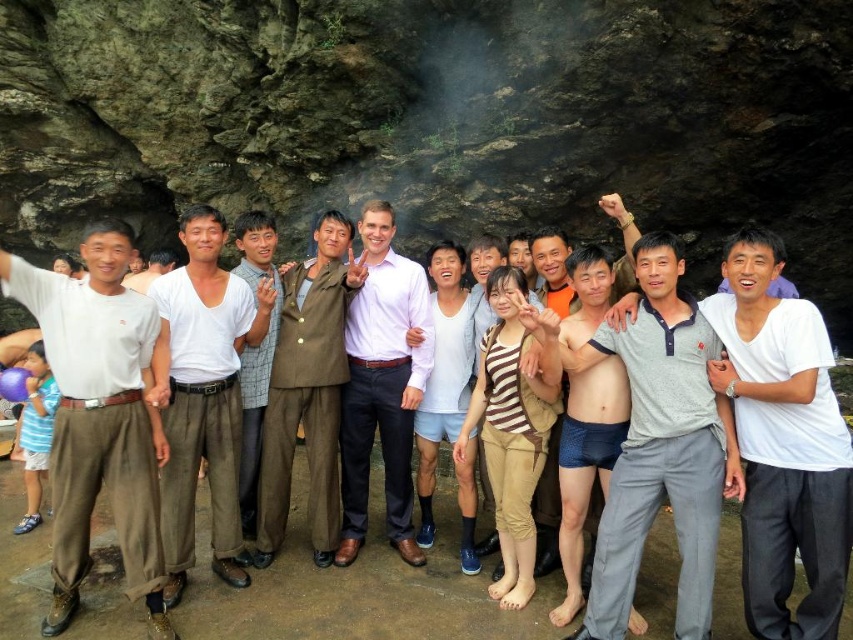
Question: Is white cotton shirt at center bigger than light brown cotton shirt at center?

Choices:
 (A) no
 (B) yes

Answer: (A)

Question: From the image, what is the correct spatial relationship of gray cotton polo shirt at center in relation to green fabric pants at center?

Choices:
 (A) left
 (B) right

Answer: (B)

Question: Does white cotton shirt at center have a lesser width compared to light brown cotton shirt at center?

Choices:
 (A) no
 (B) yes

Answer: (B)

Question: Which point is farther to the camera?

Choices:
 (A) (244, 387)
 (B) (163, 426)

Answer: (A)

Question: Estimate the real-world distances between objects in this image. Which object is closer to the green fabric pants at center?

Choices:
 (A) light brown cotton shirt at center
 (B) white cotton shirt at center
 (C) blue fabric shorts at center
 (D) gray cotton pants at center

Answer: (B)

Question: Which point is farther to the camera?

Choices:
 (A) (396, 442)
 (B) (262, 442)
 (C) (160, 250)
 (D) (693, 529)

Answer: (C)